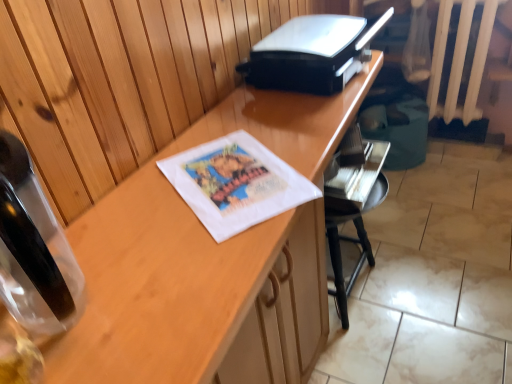
Question: Considering the relative positions of black plastic printer at upper center and wooden desk at center in the image provided, is black plastic printer at upper center to the right of wooden desk at center from the viewer's perspective?

Choices:
 (A) no
 (B) yes

Answer: (B)

Question: Can you confirm if black plastic printer at upper center is shorter than wooden desk at center?

Choices:
 (A) yes
 (B) no

Answer: (A)

Question: From a real-world perspective, is black plastic printer at upper center below wooden desk at center?

Choices:
 (A) yes
 (B) no

Answer: (B)

Question: Is black plastic printer at upper center further to camera compared to wooden desk at center?

Choices:
 (A) yes
 (B) no

Answer: (A)

Question: Is black plastic printer at upper center not close to wooden desk at center?

Choices:
 (A) no
 (B) yes

Answer: (A)

Question: Is black plastic printer at upper center turned away from wooden desk at center?

Choices:
 (A) no
 (B) yes

Answer: (A)

Question: Would you say wooden desk at center is outside black plastic printer at upper center?

Choices:
 (A) no
 (B) yes

Answer: (B)

Question: Can you confirm if wooden desk at center is positioned to the right of black plastic printer at upper center?

Choices:
 (A) yes
 (B) no

Answer: (B)

Question: From the image's perspective, does wooden desk at center appear higher than black plastic printer at upper center?

Choices:
 (A) yes
 (B) no

Answer: (B)

Question: Considering the relative sizes of wooden desk at center and black plastic printer at upper center in the image provided, is wooden desk at center taller than black plastic printer at upper center?

Choices:
 (A) yes
 (B) no

Answer: (A)

Question: Does wooden desk at center have a greater width compared to black plastic printer at upper center?

Choices:
 (A) no
 (B) yes

Answer: (B)

Question: Is wooden desk at center closer to the viewer compared to black plastic printer at upper center?

Choices:
 (A) yes
 (B) no

Answer: (A)

Question: In terms of width, does black plastic printer at upper center look wider or thinner when compared to wooden desk at center?

Choices:
 (A) thin
 (B) wide

Answer: (A)